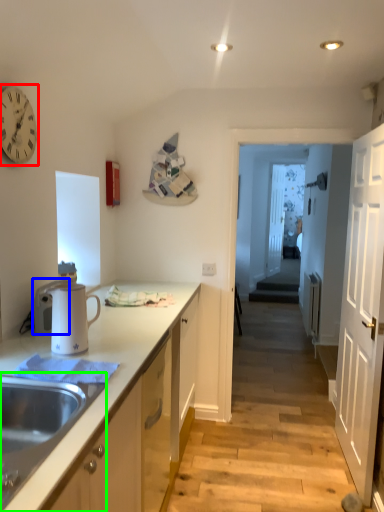
Question: Which object is positioned farthest from clock (highlighted by a red box)? Select from appliance (highlighted by a blue box) and sink (highlighted by a green box).

Choices:
 (A) appliance
 (B) sink

Answer: (B)